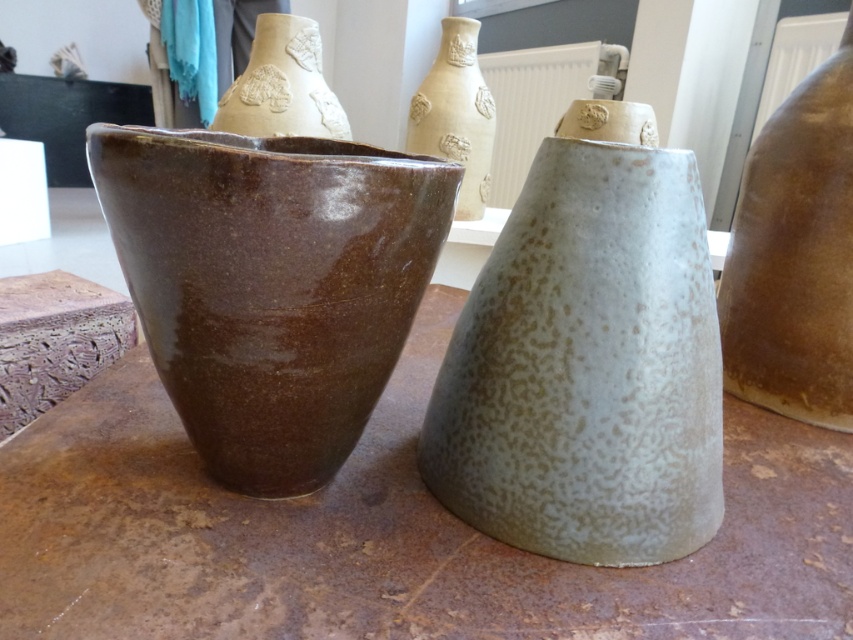
Does speckled ceramic vase at center come in front of matte beige vase at upper center?

That is True.

Which of these two, speckled ceramic vase at center or matte beige vase at upper center, stands taller?

Standing taller between the two is matte beige vase at upper center.

Which is behind, point (547, 512) or point (486, 177)?

Positioned behind is point (486, 177).

Image resolution: width=853 pixels, height=640 pixels. I want to click on speckled ceramic vase at center, so click(589, 356).

Can you confirm if speckled ceramic vase at center is wider than matte clay vase at upper center?

Incorrect, speckled ceramic vase at center's width does not surpass matte clay vase at upper center's.

Can you confirm if speckled ceramic vase at center is positioned to the left of matte clay vase at upper center?

Incorrect, speckled ceramic vase at center is not on the left side of matte clay vase at upper center.

Locate an element on the screen. speckled ceramic vase at center is located at coordinates (589, 356).

Image resolution: width=853 pixels, height=640 pixels. I want to click on speckled ceramic vase at center, so 589,356.

Who is lower down, brown glossy vase at left or matte beige vase at upper center?

brown glossy vase at left is lower down.

Which is behind, point (234, 400) or point (451, 77)?

The point (451, 77) is more distant.

The height and width of the screenshot is (640, 853). Describe the element at coordinates (270, 284) in the screenshot. I see `brown glossy vase at left` at that location.

I want to click on brown glossy vase at left, so click(270, 284).